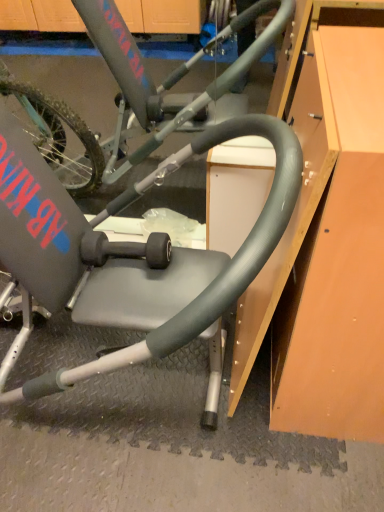
Where is `matte gray exercise chair at center`? matte gray exercise chair at center is located at coordinates (129, 258).

In order to face matte gray exercise chair at center, should I rotate leftwards or rightwards?

Rotate your view left by about 17.732°.

What do you see at coordinates (129, 258) in the screenshot?
I see `matte gray exercise chair at center` at bounding box center [129, 258].

Image resolution: width=384 pixels, height=512 pixels. In order to click on matte gray exercise chair at center in this screenshot , I will do `click(129, 258)`.